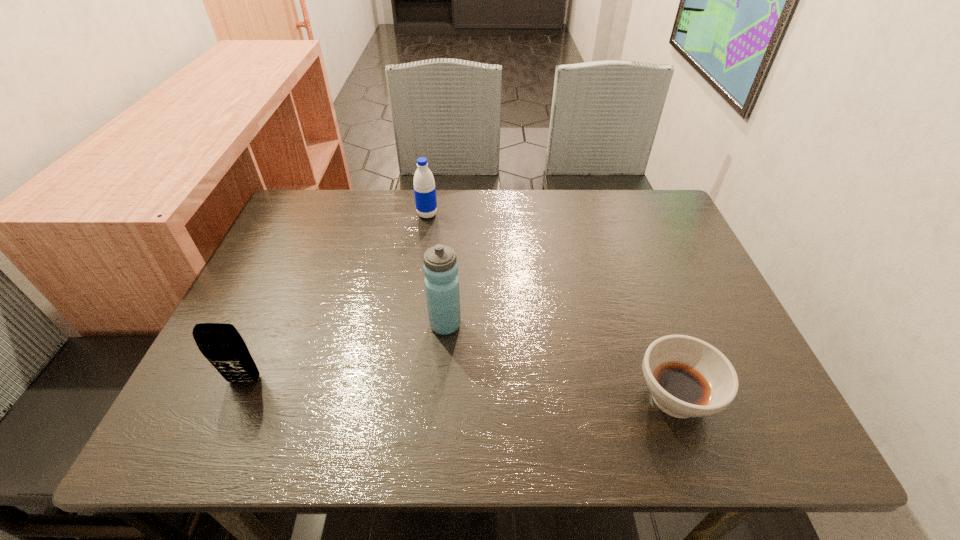
In the image, there is a desktop. Identify the location of vacant space at the far left corner. (312, 214).

Identify the location of vacant point at the near left corner. The height and width of the screenshot is (540, 960). (242, 439).

Where is `vacant area at the far right corner`? vacant area at the far right corner is located at coordinates (629, 198).

This screenshot has width=960, height=540. What are the coordinates of `vacant area that lies between the soup bowl and the cellular telephone` in the screenshot? It's located at (460, 389).

The image size is (960, 540). What are the coordinates of `vacant space that is in between the rightmost object and the second farthest object` in the screenshot? It's located at (561, 361).

Image resolution: width=960 pixels, height=540 pixels. What are the coordinates of `free point between the farthest object and the shortest object` in the screenshot? It's located at (x=551, y=306).

In order to click on empty space between the leftmost object and the right water bottle in this screenshot , I will do `click(345, 353)`.

The height and width of the screenshot is (540, 960). Find the location of `free spot between the soup bowl and the leftmost object`. free spot between the soup bowl and the leftmost object is located at coordinates (460, 389).

Image resolution: width=960 pixels, height=540 pixels. I want to click on vacant space that is in between the nearer water bottle and the leftmost object, so click(x=345, y=353).

Find the location of a particular element. This screenshot has height=540, width=960. free point between the soup bowl and the leftmost object is located at coordinates (460, 389).